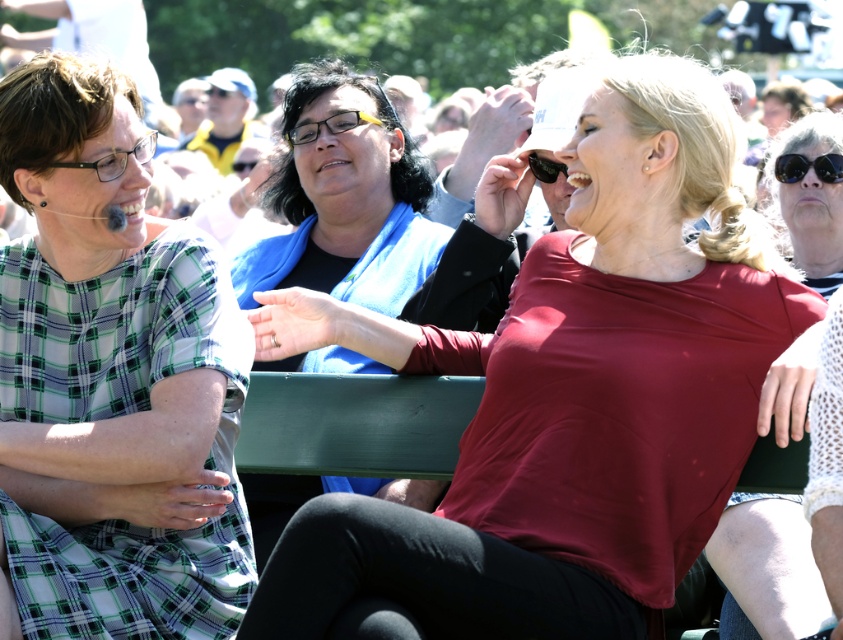
You are a photographer trying to capture a candid shot of the two women in the center of the bench. The matte red shirt at center and the matte white blouse at center are both part of your frame. Since you want to ensure both are clearly visible, which clothing item should you focus on first to account for their sizes?

The matte red shirt at center is taller than the matte white blouse at center, so you should focus on the matte red shirt at center first to ensure it is in clear focus before adjusting for the smaller matte white blouse at center.

Looking at this image, you are designing a new bench for an outdoor space and want to ensure it can accommodate the clothing items seen in the scene. The green plaid dress at left and the matte black sunglasses at center are both on the bench. Given their sizes, which item takes up more space on the bench?

The green plaid dress at left takes up more space on the bench because its width is larger than that of the matte black sunglasses at center.

You are a photographer trying to capture a candid shot of the two women on the left side of the bench. However, you notice that the matte black glasses at left and the black reflective sunglasses at upper right might obstruct your view. Based on their positions, which glasses are more likely blocking the view of the women?

The matte black glasses at left is behind the black reflective sunglasses at upper right, so the black reflective sunglasses at upper right are in front and might be blocking the view of the women.